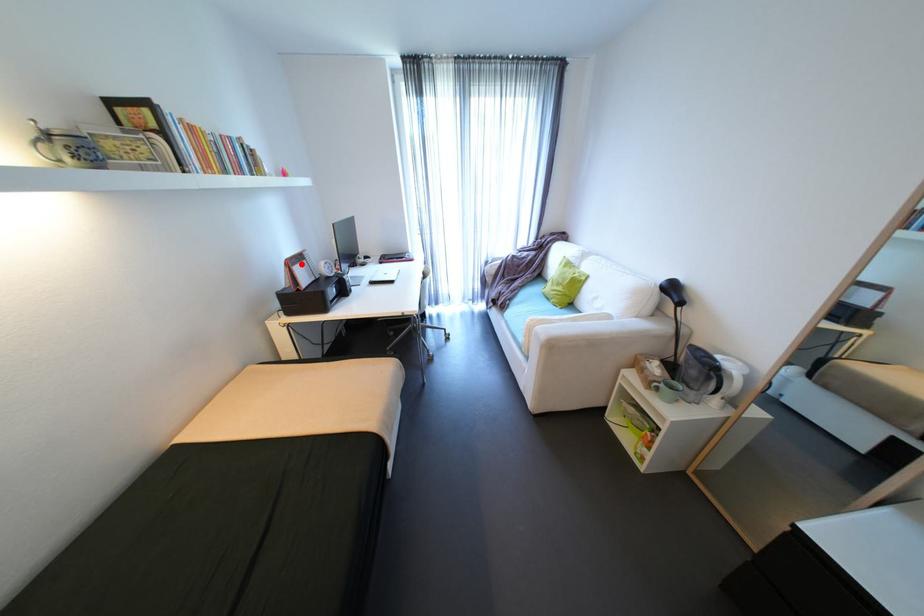
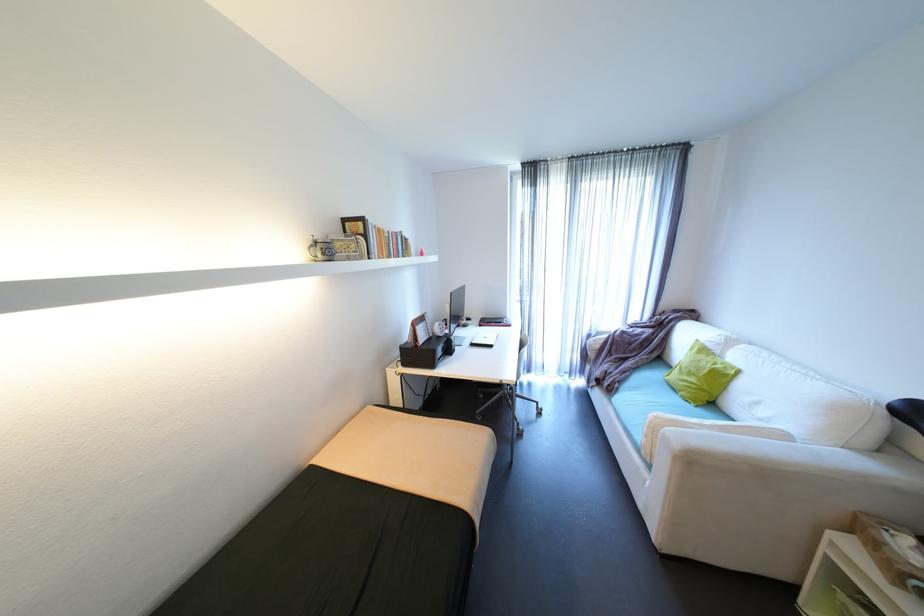
Question: I am providing you with two images of the same scene from different viewpoints. A red point is marked on the first image. Is the red point's position out of view in image 2?

Choices:
 (A) Yes
 (B) No

Answer: (B)